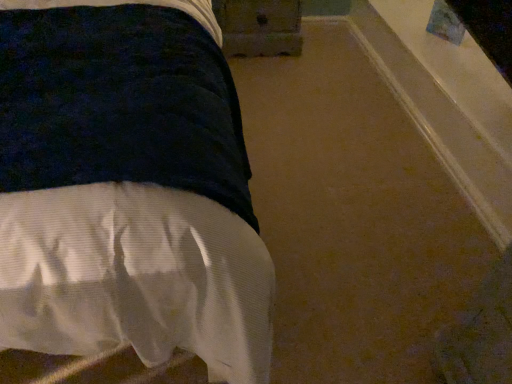
At what (x,y) coordinates should I click in order to perform the action: click on free point in front of wooden drawer at upper center. Please return your answer as a coordinate pair (x, y). This screenshot has height=384, width=512. Looking at the image, I should click on (278, 83).